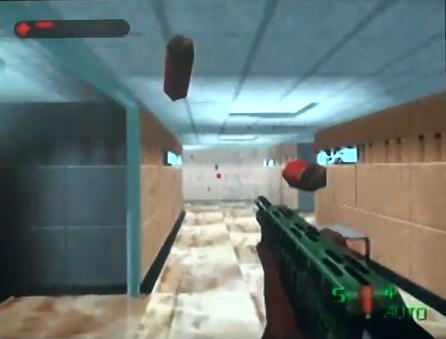
This screenshot has height=339, width=446. In order to click on walls in this screenshot , I will do `click(151, 197)`, `click(236, 171)`, `click(378, 188)`, `click(71, 207)`, `click(310, 149)`.